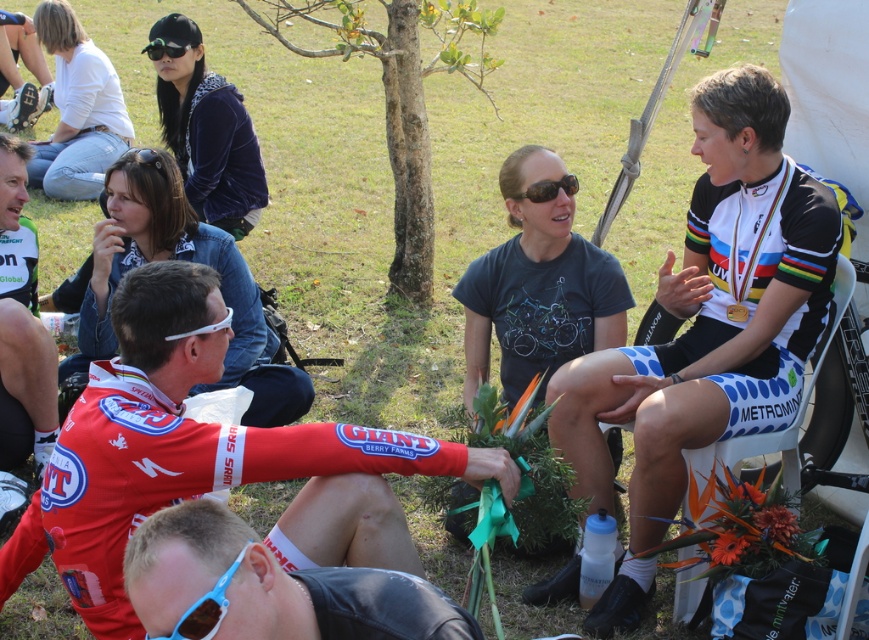
Is white jersey at center positioned in front of blue plastic sunglasses at lower left?

No, white jersey at center is further to the viewer.

Who is more forward, (788,168) or (204,600)?

Positioned in front is point (204,600).

Describe the element at coordinates (707, 324) in the screenshot. I see `white jersey at center` at that location.

Where is `white jersey at center`? This screenshot has height=640, width=869. white jersey at center is located at coordinates (707, 324).

Between reddish-brown leather jacket at lower left and black matte sunglasses at center, which one has less height?

With less height is black matte sunglasses at center.

Does point (349, 605) come closer to viewer compared to point (549, 192)?

Yes, it is.

Identify the location of reddish-brown leather jacket at lower left. The width and height of the screenshot is (869, 640). (269, 588).

Describe the element at coordinates (801, 397) in the screenshot. I see `white plastic folding chair at right` at that location.

Which of these two, white plastic folding chair at right or blue plastic sunglasses at lower left, stands shorter?

blue plastic sunglasses at lower left

Is point (804, 392) positioned behind point (210, 598)?

Yes, point (804, 392) is farther from viewer.

Identify the location of white plastic folding chair at right. Image resolution: width=869 pixels, height=640 pixels. (801, 397).